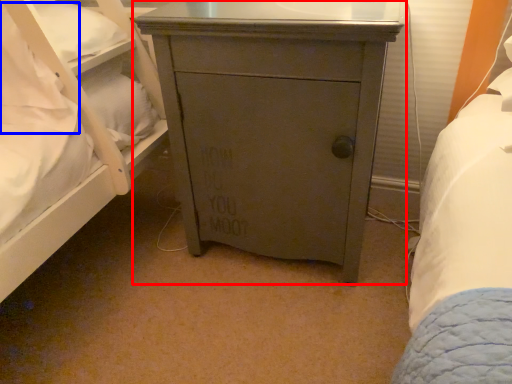
Question: Which object is closer to the camera taking this photo, chest of drawers (highlighted by a red box) or pillow (highlighted by a blue box)?

Choices:
 (A) chest of drawers
 (B) pillow

Answer: (A)